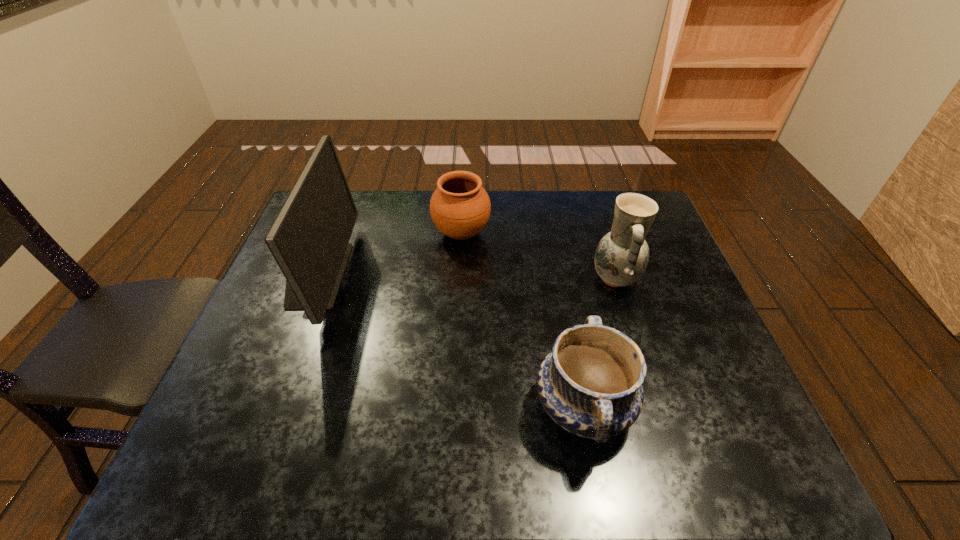
Locate an element on the screen. The image size is (960, 540). the leftmost object is located at coordinates (309, 239).

Identify the location of the tallest object. (309, 239).

Image resolution: width=960 pixels, height=540 pixels. Identify the location of the third shortest object. (622, 255).

Identify the location of the tallest pottery. (622, 255).

Find the location of a particular element. the farthest pottery is located at coordinates (460, 207).

Locate an element on the screen. The image size is (960, 540). the leftmost pottery is located at coordinates (460, 207).

This screenshot has width=960, height=540. Identify the location of the nearest pottery. (590, 384).

Where is `free space located on the screen side of the tallest object`? This screenshot has height=540, width=960. free space located on the screen side of the tallest object is located at coordinates (447, 274).

Locate an element on the screen. The width and height of the screenshot is (960, 540). vacant space located on either side of the second nearest pottery is located at coordinates (474, 279).

At what (x,y) coordinates should I click in order to perform the action: click on free space located on either side of the second nearest pottery. Please return your answer as a coordinate pair (x, y). The height and width of the screenshot is (540, 960). Looking at the image, I should click on (460, 279).